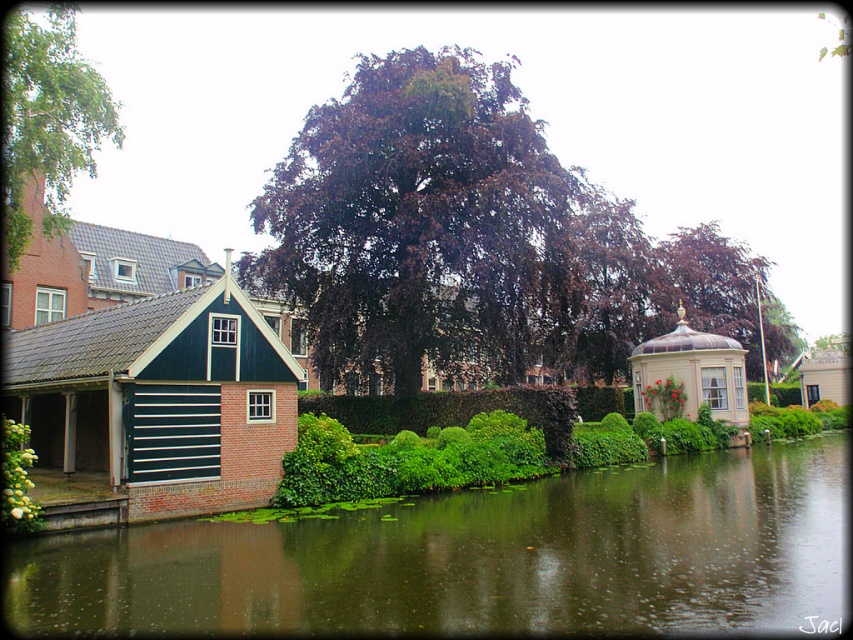
Is green reflective water at lower center closer to camera compared to white fluffy bush at lower left?

Yes.

Is point (345, 573) less distant than point (19, 428)?

Yes, point (345, 573) is in front of point (19, 428).

The width and height of the screenshot is (853, 640). What are the coordinates of `green reflective water at lower center` in the screenshot? It's located at (480, 557).

Identify the location of green reflective water at lower center. Image resolution: width=853 pixels, height=640 pixels. (480, 557).

Who is positioned more to the right, green reflective water at lower center or dark purple leafy tree at center?

green reflective water at lower center is more to the right.

Is green reflective water at lower center bigger than dark purple leafy tree at center?

Actually, green reflective water at lower center might be smaller than dark purple leafy tree at center.

Who is more distant from viewer, (724, 554) or (572, 248)?

The point (572, 248) is behind.

Locate an element on the screen. The height and width of the screenshot is (640, 853). green reflective water at lower center is located at coordinates (480, 557).

Is dark purple leafy tree at center taller than white fluffy bush at lower left?

Yes.

Is point (314, 365) positioned in front of point (10, 420)?

No, it is not.

Between point (460, 243) and point (7, 432), which one is positioned behind?

Point (460, 243)

At what (x,y) coordinates should I click in order to perform the action: click on dark purple leafy tree at center. Please return your answer as a coordinate pair (x, y). The height and width of the screenshot is (640, 853). Looking at the image, I should click on (469, 240).